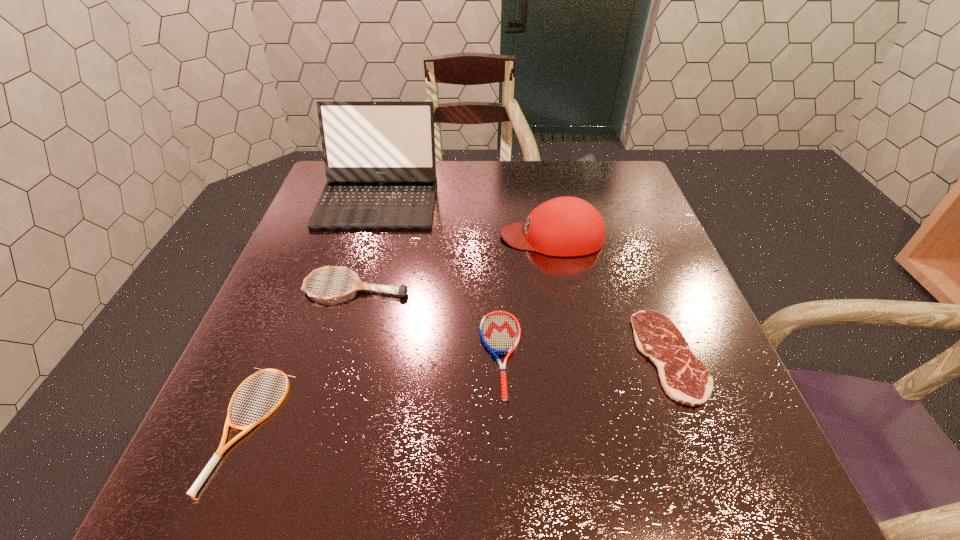
Find the location of a particular element. The image size is (960, 540). free space at the far edge is located at coordinates (464, 186).

At what (x,y) coordinates should I click in order to perform the action: click on free space at the near edge of the desktop. Please return your answer as a coordinate pair (x, y). The image size is (960, 540). Looking at the image, I should click on (514, 466).

The height and width of the screenshot is (540, 960). What are the coordinates of `vacant region at the left edge of the desktop` in the screenshot? It's located at (285, 281).

You are a GUI agent. You are given a task and a screenshot of the screen. Output one action in this format:
    pyautogui.click(x=<x>, y=<y>)
    Task: Click on the vacant space at the near left corner
    This screenshot has width=960, height=540.
    Given the screenshot: What is the action you would take?
    pyautogui.click(x=195, y=480)

In the image, there is a desktop. Where is `free space at the far right corner`? The image size is (960, 540). free space at the far right corner is located at coordinates (645, 204).

Locate an element on the screen. vacant area that lies between the laptop and the rightmost tennis racket is located at coordinates (440, 276).

I want to click on unoccupied area between the third farthest object and the baseball cap, so click(454, 261).

At what (x,y) coordinates should I click in order to perform the action: click on vacant space that is in between the baseball cap and the tallest object. Please return your answer as a coordinate pair (x, y). Looking at the image, I should click on (466, 218).

Locate an element on the screen. free point between the tallest object and the steak is located at coordinates (524, 277).

Find the location of a particular element. free space between the tallest object and the steak is located at coordinates (524, 277).